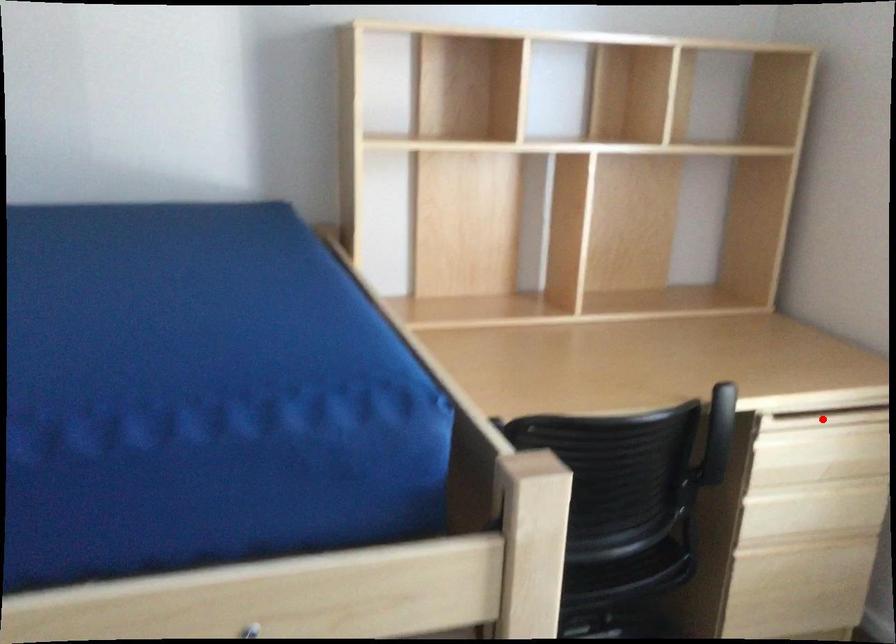
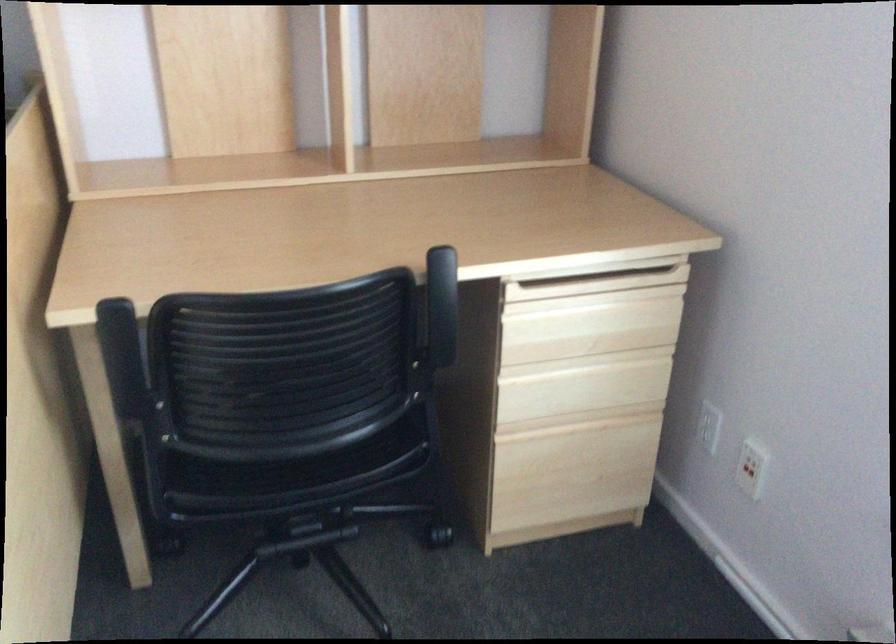
The point at the highlighted location is marked in the first image. Where is the corresponding point in the second image?

(587, 286)